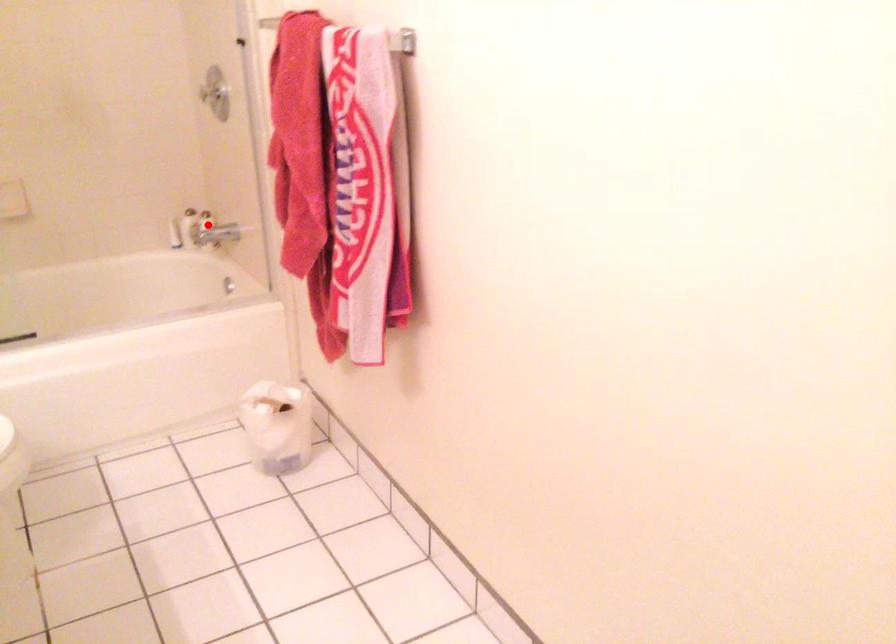
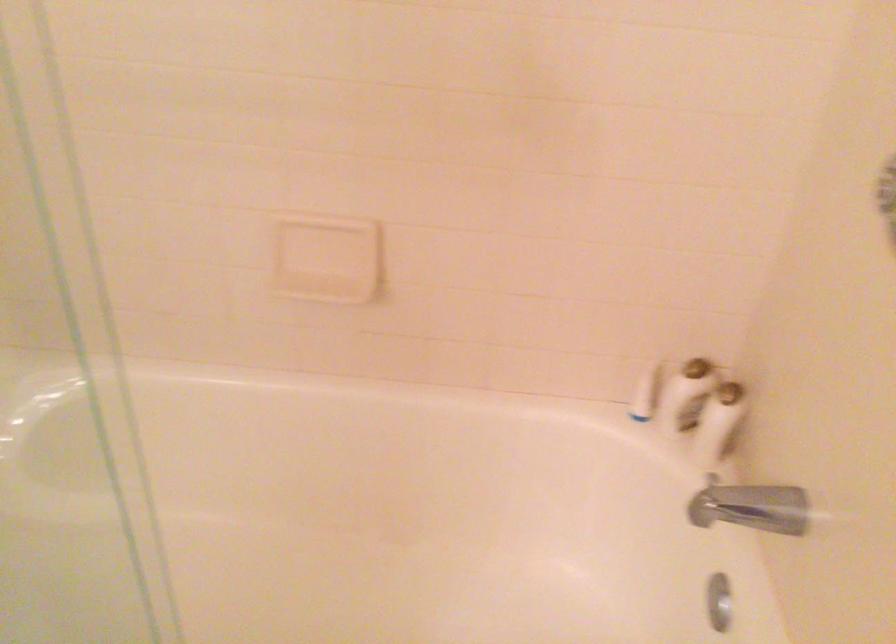
Locate, in the second image, the point that corresponds to the highlighted location in the first image.

(718, 422)